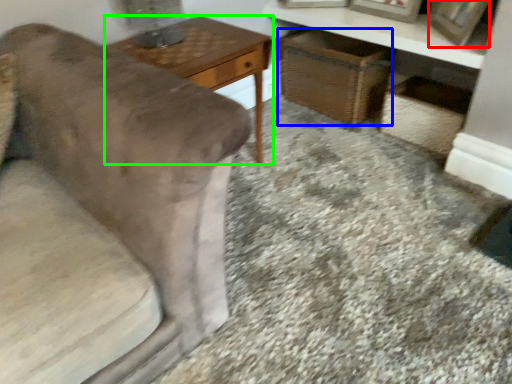
Question: Which object is positioned farthest from picture frame (highlighted by a red box)? Select from basket (highlighted by a blue box) and table (highlighted by a green box).

Choices:
 (A) basket
 (B) table

Answer: (B)